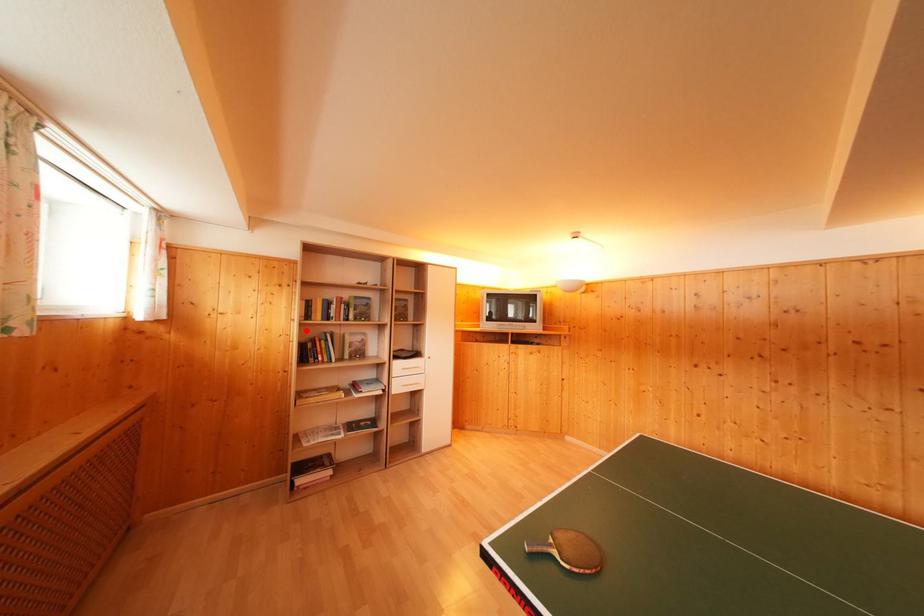
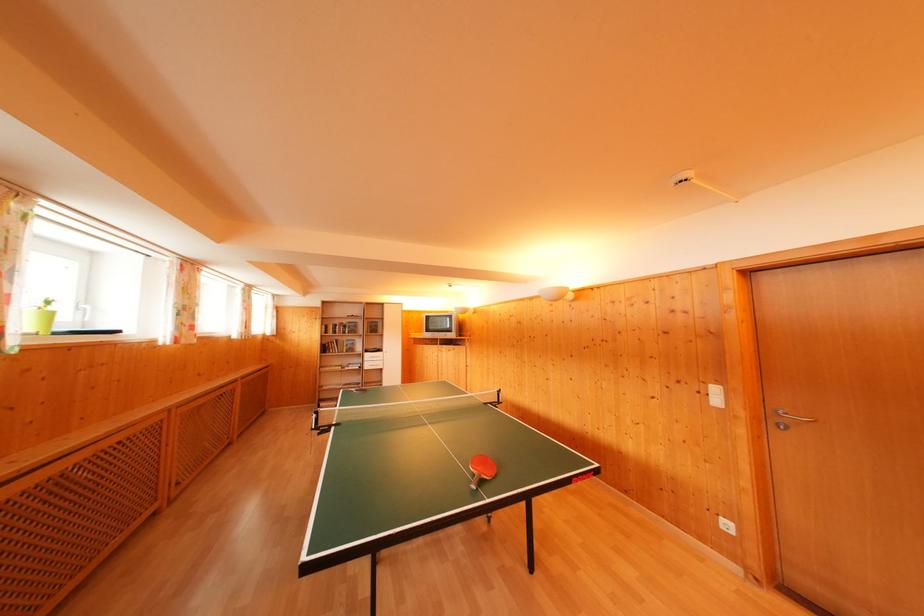
In the second image, find the point that corresponds to the highlighted location in the first image.

(326, 342)